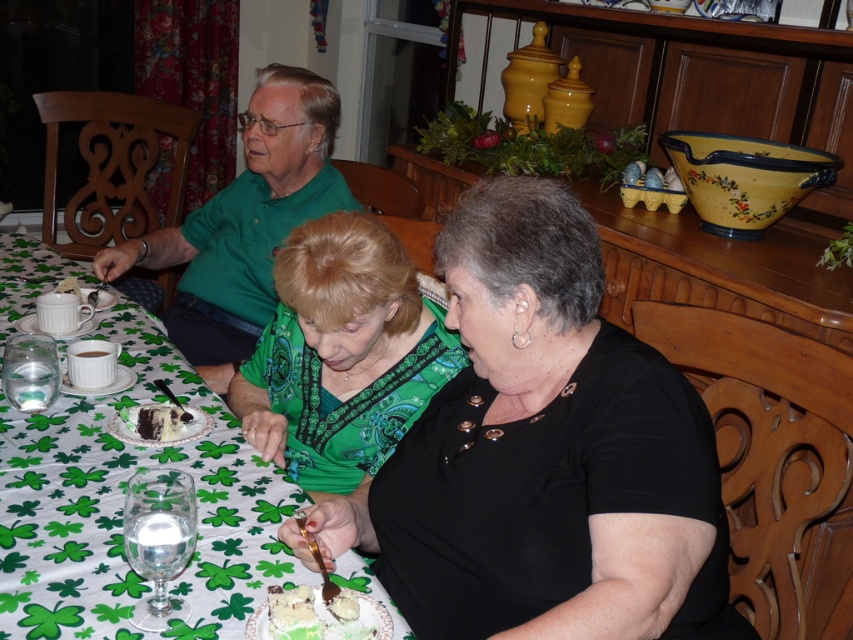
Is point (546, 435) positioned before point (347, 436)?

Yes, it is.

This screenshot has height=640, width=853. What do you see at coordinates (546, 452) in the screenshot? I see `black matte shirt at center` at bounding box center [546, 452].

Where is `black matte shirt at center`? Image resolution: width=853 pixels, height=640 pixels. black matte shirt at center is located at coordinates (546, 452).

Is black matte shirt at center thinner than green matte shirt at upper left?

Yes, black matte shirt at center is thinner than green matte shirt at upper left.

Measure the distance between point (538, 630) and camera.

Point (538, 630) and camera are 33.74 inches apart.

Find the location of `black matte shirt at center`. black matte shirt at center is located at coordinates (546, 452).

In the scene shown: Is green matte shirt at upper left to the right of green frosted cake at lower center from the viewer's perspective?

No, green matte shirt at upper left is not to the right of green frosted cake at lower center.

Between green matte shirt at upper left and green frosted cake at lower center, which one is positioned higher?

green matte shirt at upper left is higher up.

Between point (184, 298) and point (390, 630), which one is positioned in front?

Positioned in front is point (390, 630).

Where is `green matte shirt at upper left`? green matte shirt at upper left is located at coordinates (245, 224).